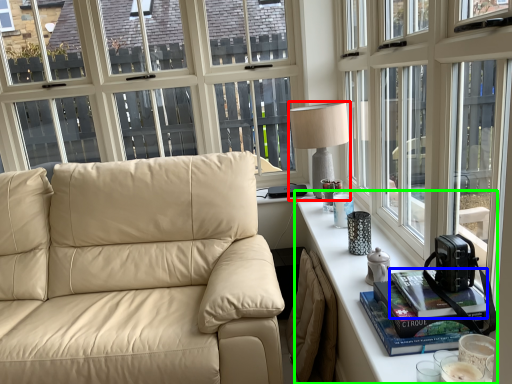
Question: Considering the real-world distances, which object is closest to table lamp (highlighted by a red box)? book (highlighted by a blue box) or table (highlighted by a green box).

Choices:
 (A) book
 (B) table

Answer: (B)